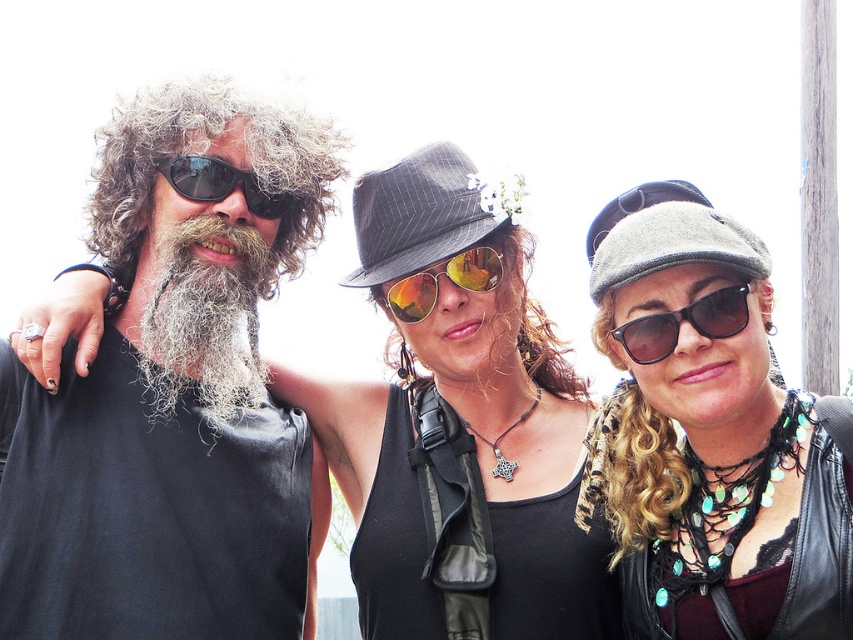
Looking at this image, you are a photographer trying to capture a closeup of the reflective gold sunglasses at center and the black reflective sunglasses at left. Since both are reflective, you want to ensure that the sunlight hitting them doesn not cause overexposure. Given their sizes, which sunglasses should you adjust your camera settings for first to avoid overexposure?

The reflective gold sunglasses at center is bigger than black reflective sunglasses at left, so you should adjust your camera settings for the reflective gold sunglasses at center first because its larger size will reflect more light and require more careful exposure control to avoid overexposure.

You are a photographer trying to capture the black reflective sunglasses at left. The sunglasses are located at point (219, 182). To avoid glare, you need to position yourself so that the sun is behind you and not reflecting off the sunglasses. Based on the scene description, where should you position yourself relative to the sunglasses?

Since the scene has bright daylight with a strong light source causing overexposure in the background, the photographer should position themselves so the sun is behind them, facing away from the overexposed background. This way, the light source is directed towards the sunglasses, reducing glare reflections.